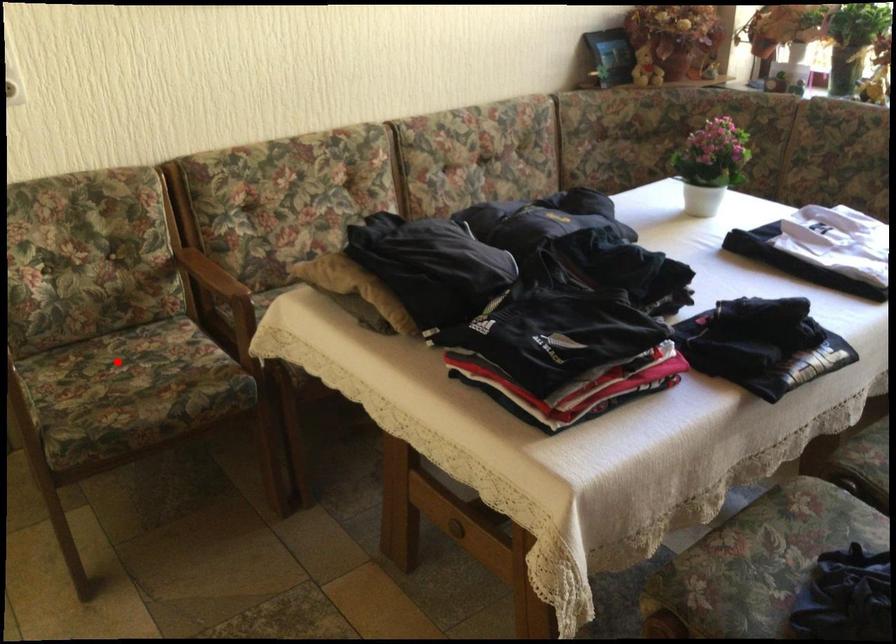
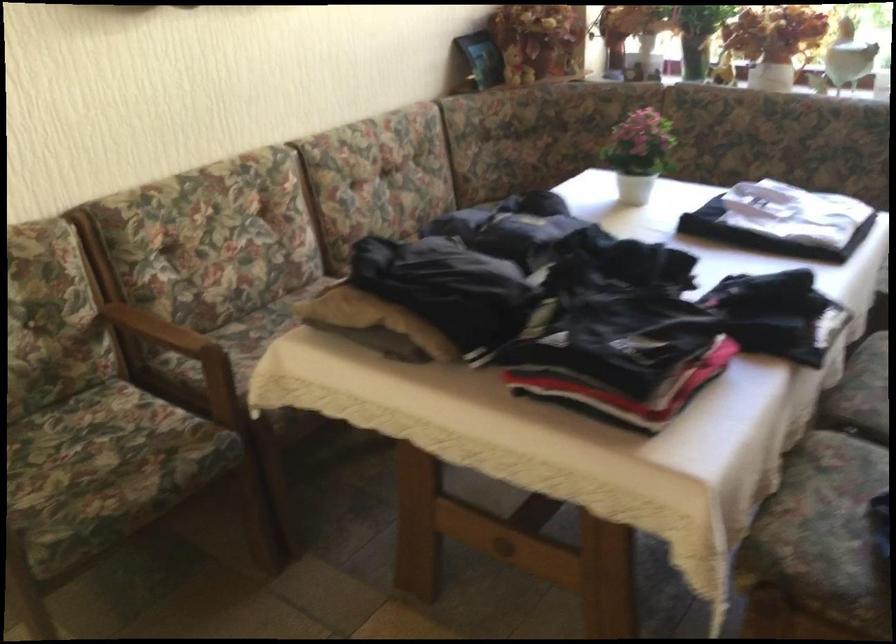
Question: I am providing you with two images of the same scene from different viewpoints. In image1, a red point is highlighted. Considering the same 3D point in image2, which of the following is correct?

Choices:
 (A) It is closer
 (B) It is farther

Answer: (A)